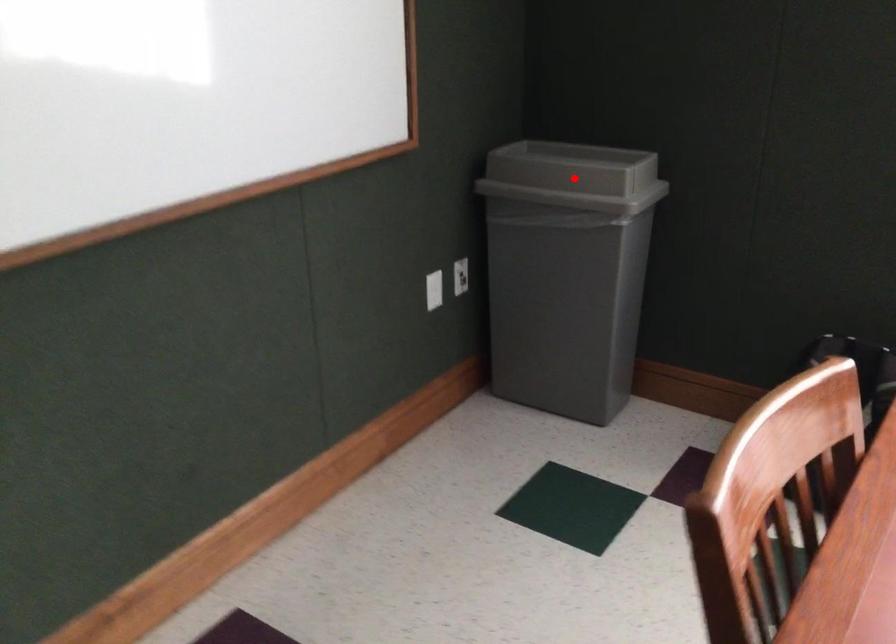
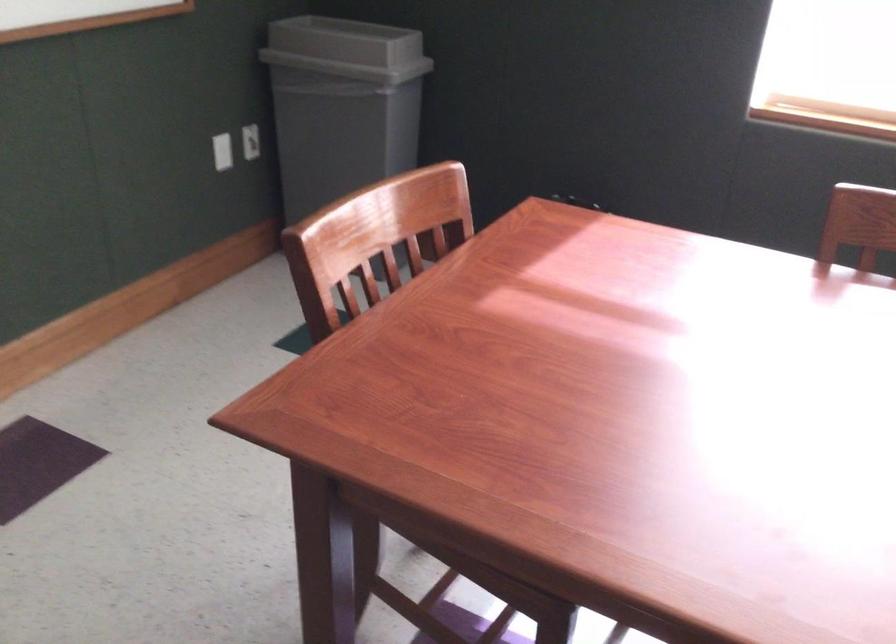
Where in the second image is the point corresponding to the highlighted location from the first image?

(346, 49)